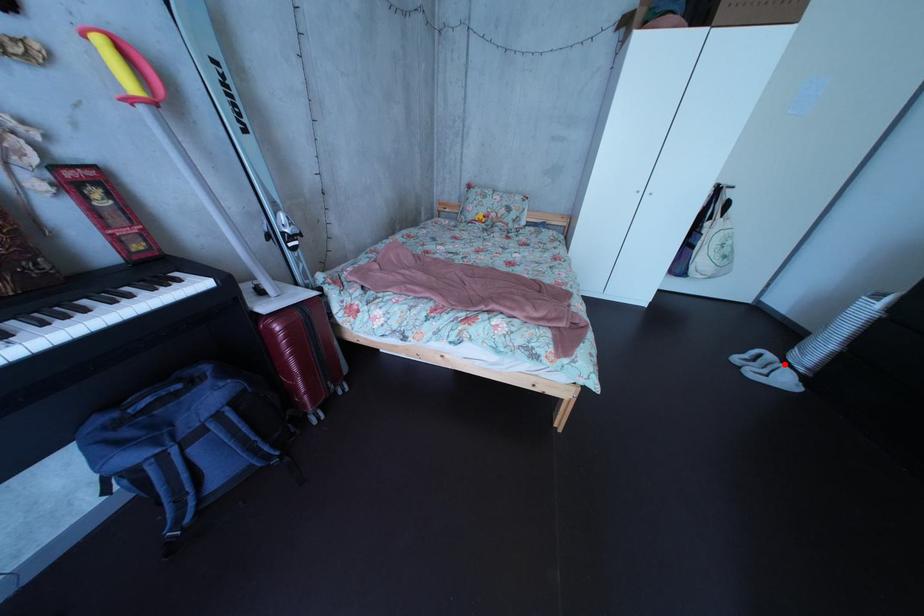
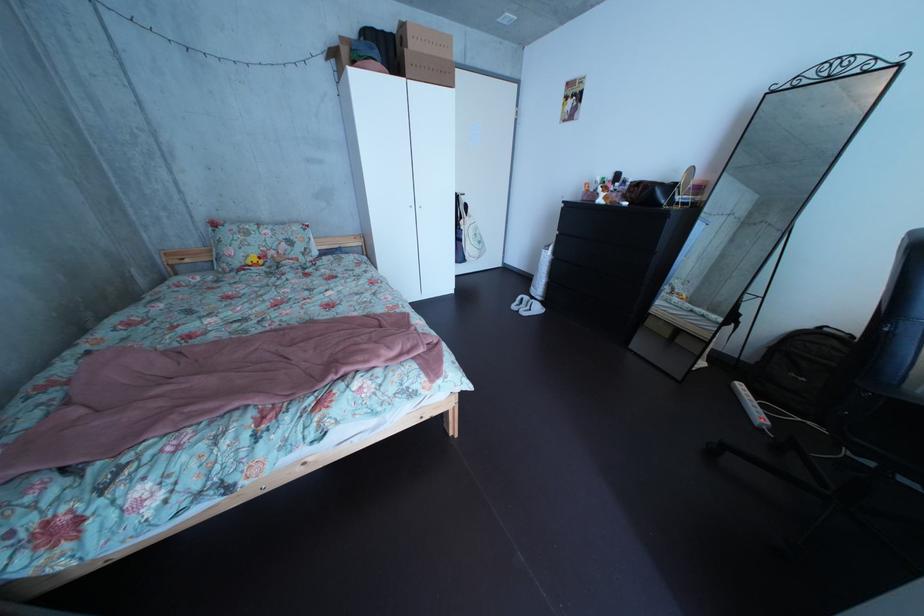
Question: I am providing you with two images of the same scene from different viewpoints. In image1, a red point is highlighted. Considering the same 3D point in image2, which of the following is correct?

Choices:
 (A) It is closer
 (B) It is farther

Answer: (A)